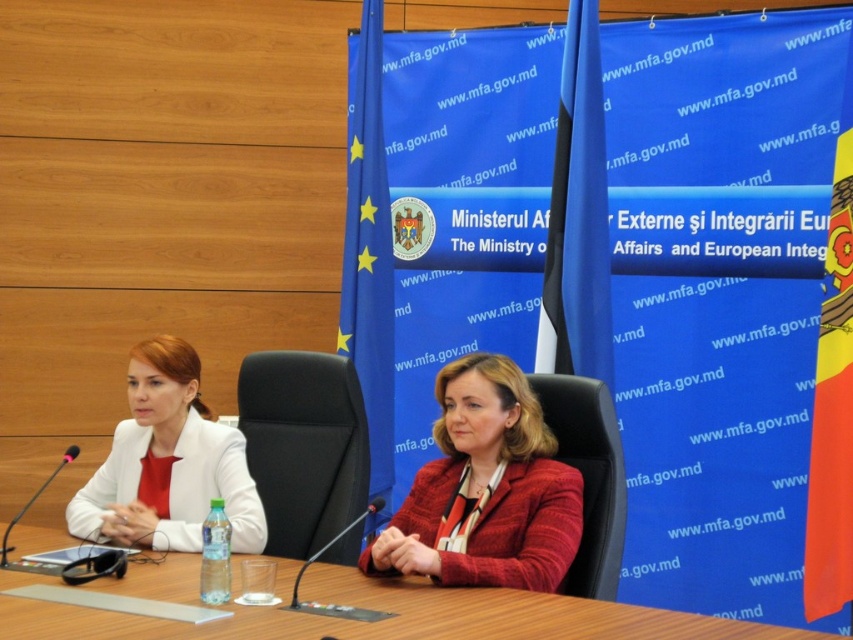
Can you confirm if wooden table at center is positioned to the left of matte white blazer at left?

In fact, wooden table at center is to the right of matte white blazer at left.

Does point (381, 634) lie behind point (206, 442)?

No, (381, 634) is closer to viewer.

Is point (722, 628) farther from viewer compared to point (206, 449)?

That is False.

At what (x,y) coordinates should I click in order to perform the action: click on wooden table at center. Please return your answer as a coordinate pair (x, y). The height and width of the screenshot is (640, 853). Looking at the image, I should click on (364, 605).

Which is above, wooden table at center or matte red blazer at center?

matte red blazer at center is above.

Which is in front, point (775, 632) or point (489, 513)?

Point (775, 632) is in front.

Does point (358, 602) come behind point (498, 433)?

No, it is not.

Find the location of a particular element. This screenshot has width=853, height=640. wooden table at center is located at coordinates (364, 605).

Is matte red blazer at center thinner than matte white blazer at left?

Correct, matte red blazer at center's width is less than matte white blazer at left's.

Does matte red blazer at center have a smaller size compared to matte white blazer at left?

Incorrect, matte red blazer at center is not smaller in size than matte white blazer at left.

Does point (469, 513) come behind point (253, 484)?

No, it is not.

This screenshot has height=640, width=853. In order to click on matte red blazer at center in this screenshot , I will do `click(485, 490)`.